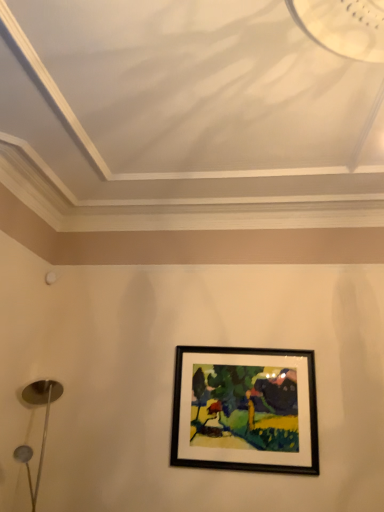
Question: Should I look upward or downward to see black matte picture frame at center?

Choices:
 (A) down
 (B) up

Answer: (A)